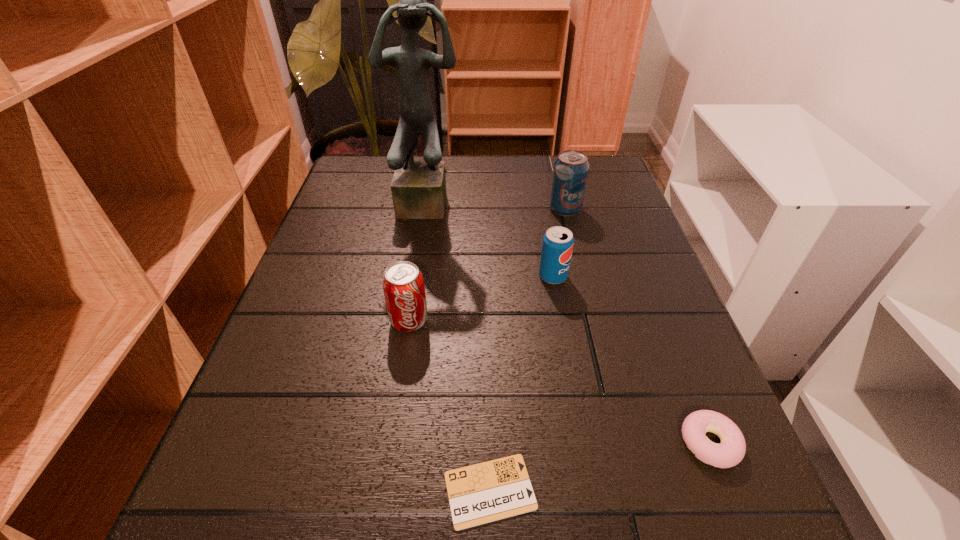
Find the location of a particular element. This screenshot has width=960, height=540. object that is positioned at the far left corner is located at coordinates (418, 188).

The height and width of the screenshot is (540, 960). Find the location of `object that is at the far right corner`. object that is at the far right corner is located at coordinates (570, 173).

In the image, there is a desktop. At what (x,y) coordinates should I click in order to perform the action: click on vacant space at the far edge. Please return your answer as a coordinate pair (x, y). This screenshot has height=540, width=960. Looking at the image, I should click on (x=548, y=164).

Where is `free space at the near edge`? The height and width of the screenshot is (540, 960). free space at the near edge is located at coordinates (499, 536).

In the image, there is a desktop. Identify the location of vacant area at the left edge. The height and width of the screenshot is (540, 960). (340, 300).

Locate an element on the screen. This screenshot has height=540, width=960. free spot at the right edge of the desktop is located at coordinates (636, 413).

Locate an element on the screen. The height and width of the screenshot is (540, 960). vacant space at the far left corner is located at coordinates (352, 156).

Locate an element on the screen. free spot between the farthest soda can and the fourth farthest object is located at coordinates (488, 265).

This screenshot has height=540, width=960. In order to click on free space between the shortest object and the farthest soda can in this screenshot , I will do [x=528, y=350].

I want to click on unoccupied position between the leftmost soda can and the identity card, so click(x=449, y=406).